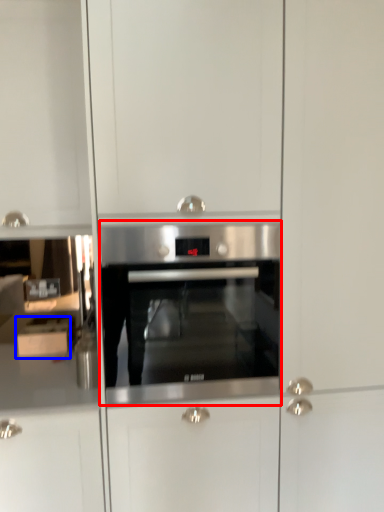
Question: Which point is closer to the camera, oven (highlighted by a red box) or cabinetry (highlighted by a blue box)?

Choices:
 (A) oven
 (B) cabinetry

Answer: (A)